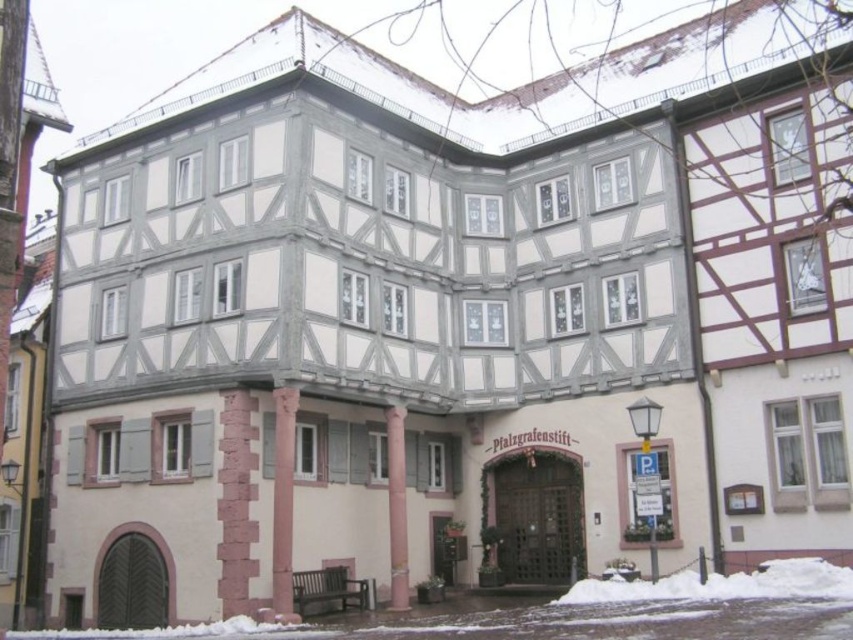
In the scene shown: You are an architect designing a winter scene and want to place a pink painted wood column at center in front of the white powdery snow at lower left. Based on their sizes, will the snow be mostly visible behind the column?

The white powdery snow at lower left is bigger than the pink painted wood column at center, so the snow will still be mostly visible behind the column.

You are standing in front of the traditional half timbered building and want to place a small snowman at the location of the white powdery snow at lower left. What are the coordinates of the location where you should place the snowman?

The coordinates for the white powdery snow at lower left are at point [596,612], so you should place the snowman at those coordinates.

You are a delivery person with a cart that is 2 meters wide. You need to deliver a package to the building. The path between the white powdery snow at lower center and the pink stone pillar at lower left is the only route available. Can your cart fit through this path?

The distance between the white powdery snow at lower center and the pink stone pillar at lower left is 20.49 meters. Since your cart is only 2 meters wide, it can easily fit through the path as the distance is much wider than the cart.